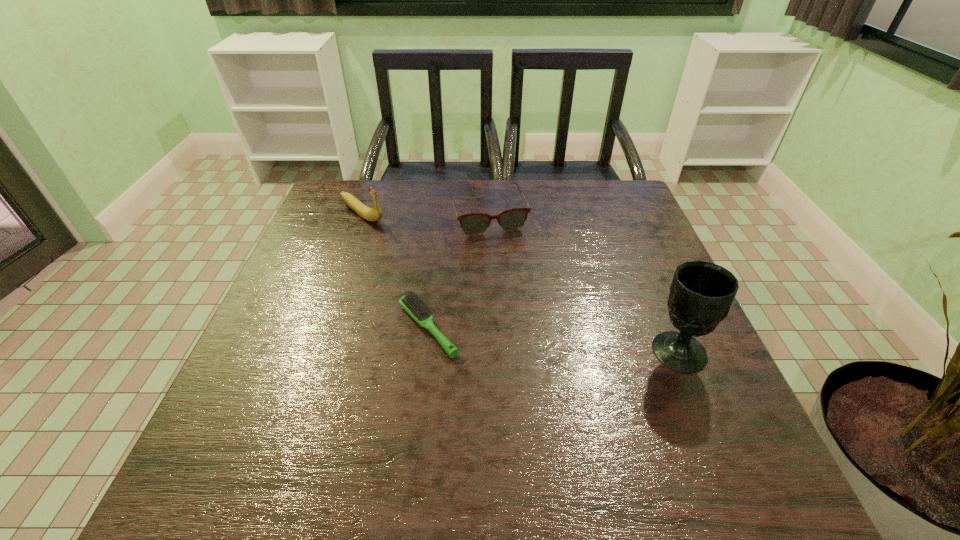
Find the location of a particular element. vacant spot on the desktop that is between the shortest object and the rightmost object and is positioned at the front view of the spectacles is located at coordinates (535, 338).

Locate an element on the screen. vacant space on the desktop that is between the hairbrush and the chalice and is positioned at the stem of the leftmost object is located at coordinates (538, 338).